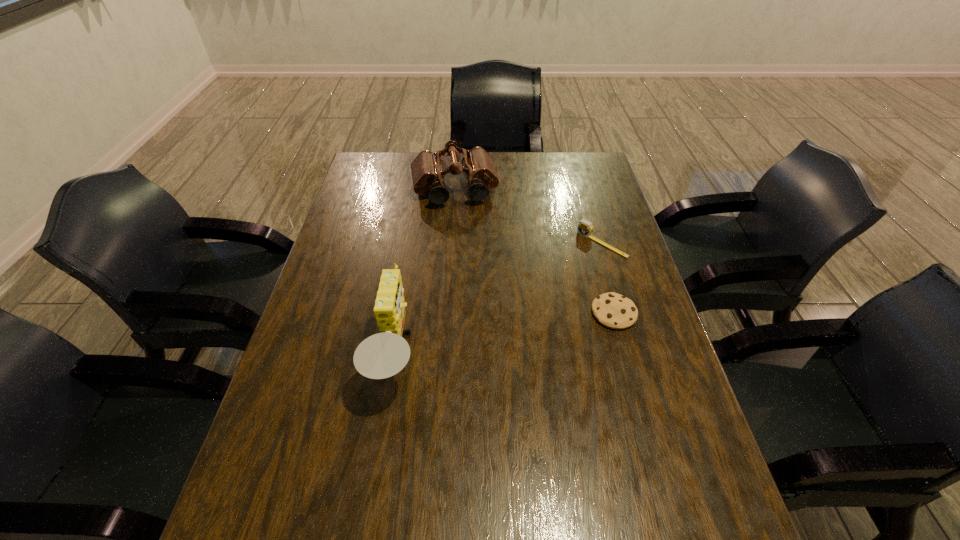
The height and width of the screenshot is (540, 960). In order to click on free spot at the far left corner of the desktop in this screenshot , I will do `click(401, 160)`.

Identify the location of free space between the farthest object and the shortest object. Image resolution: width=960 pixels, height=540 pixels. (534, 252).

At what (x,y) coordinates should I click in order to perform the action: click on free spot between the shortest object and the binoculars. Please return your answer as a coordinate pair (x, y). Image resolution: width=960 pixels, height=540 pixels. Looking at the image, I should click on (534, 252).

The height and width of the screenshot is (540, 960). I want to click on unoccupied area between the shortest object and the sponge, so click(505, 334).

Locate an element on the screen. Image resolution: width=960 pixels, height=540 pixels. blank region between the binoculars and the tallest object is located at coordinates (425, 273).

You are a GUI agent. You are given a task and a screenshot of the screen. Output one action in this format:
    pyautogui.click(x=<x>, y=<y>)
    Task: Click on the free area in between the second farthest object and the second tallest object
    Image resolution: width=960 pixels, height=540 pixels.
    Given the screenshot: What is the action you would take?
    point(528,217)

The image size is (960, 540). Find the location of `free spot between the tallest object and the cookie`. free spot between the tallest object and the cookie is located at coordinates (505, 334).

The image size is (960, 540). In order to click on free space between the shortest object and the binoculars in this screenshot , I will do `click(534, 252)`.

What are the coordinates of `free spot between the second tallest object and the second shortest object` in the screenshot? It's located at (528, 217).

At what (x,y) coordinates should I click in order to perform the action: click on vacant space in between the farthest object and the sponge. Please return your answer as a coordinate pair (x, y). The width and height of the screenshot is (960, 540). Looking at the image, I should click on (425, 273).